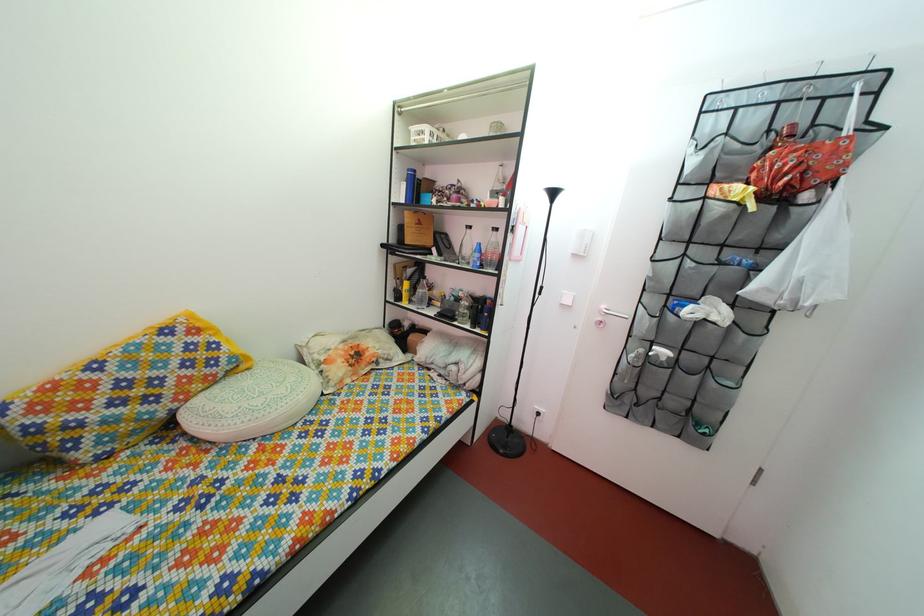
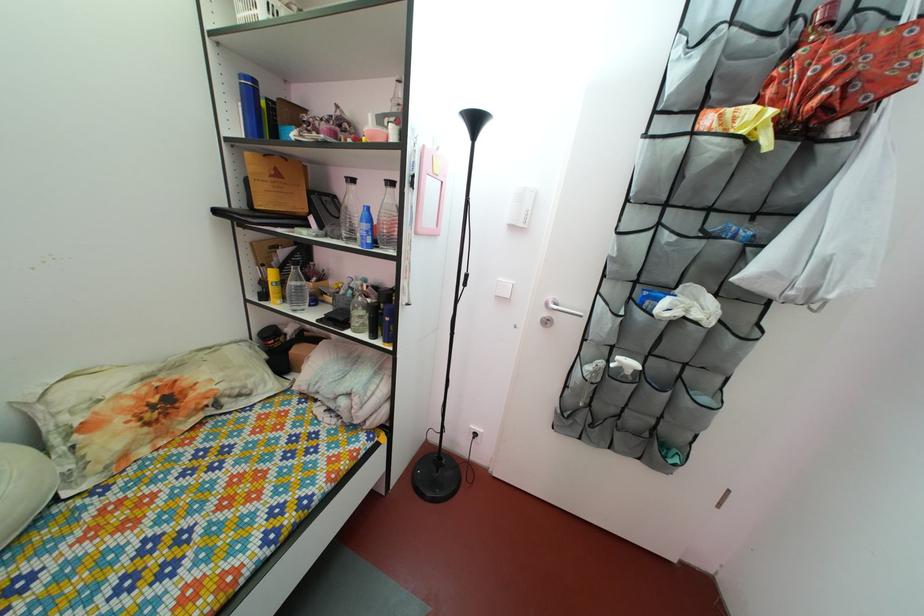
In the second image, find the point that corresponds to pixel 785 188 in the first image.

(816, 103)